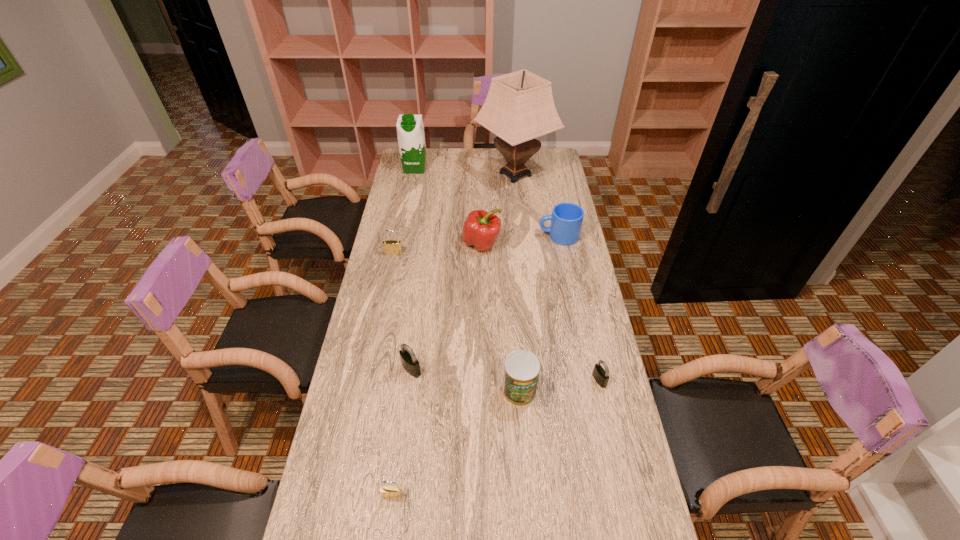
This screenshot has height=540, width=960. I want to click on vacant space in between the lampshade and the can, so click(x=517, y=282).

Find the location of a particular element. This screenshot has height=540, width=960. free space that is in between the left brass padlock and the can is located at coordinates (457, 322).

You are a GUI agent. You are given a task and a screenshot of the screen. Output one action in this format:
    pyautogui.click(x=<x>, y=<y>)
    Task: Click on the vacant area between the soya milk and the tallest object
    The width and height of the screenshot is (960, 540).
    Given the screenshot: What is the action you would take?
    click(x=466, y=171)

Where is `free space between the left black padlock and the right brass padlock`? The height and width of the screenshot is (540, 960). free space between the left black padlock and the right brass padlock is located at coordinates (402, 433).

Locate which object ranks second in proximity to the mug. Please provide its 2D coordinates. Your answer should be formatted as a tuple, i.e. [(x, y)], where the tuple contains the x and y coordinates of a point satisfying the conditions above.

[(519, 107)]

Identify which object is located as the seventh nearest to the smaller brass padlock. Please provide its 2D coordinates. Your answer should be formatted as a tuple, i.e. [(x, y)], where the tuple contains the x and y coordinates of a point satisfying the conditions above.

[(519, 107)]

Locate which padlock is the second closest to the pepper. Please provide its 2D coordinates. Your answer should be formatted as a tuple, i.e. [(x, y)], where the tuple contains the x and y coordinates of a point satisfying the conditions above.

[(409, 361)]

Where is `the second closest padlock to the mug`? This screenshot has height=540, width=960. the second closest padlock to the mug is located at coordinates (600, 375).

Where is `free space in the image that satisfies the following two spatial constraints: 1. on the side of the mug with the handle; 2. on the front-facing side of the left brass padlock`? The width and height of the screenshot is (960, 540). free space in the image that satisfies the following two spatial constraints: 1. on the side of the mug with the handle; 2. on the front-facing side of the left brass padlock is located at coordinates (562, 253).

The image size is (960, 540). I want to click on vacant region that satisfies the following two spatial constraints: 1. on the front side of the lampshade; 2. on the right side of the rightmost padlock, so click(x=537, y=380).